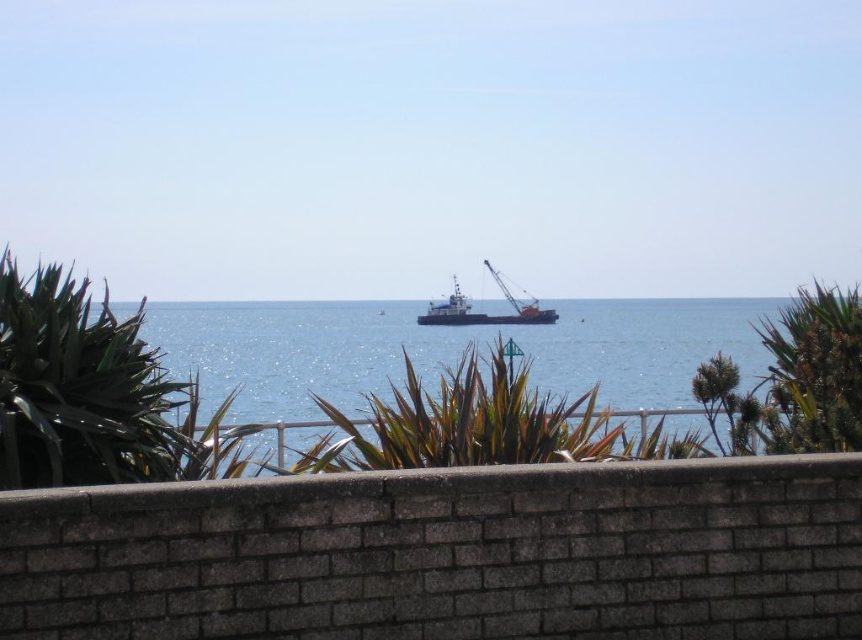
You are standing behind the low brick wall and want to take a photo of the blue water at center and the orange matte cargo ship at center. Which object will appear wider in the photo?

The blue water at center will appear wider in the photo because its width is larger than that of the orange matte cargo ship at center.

Looking at this image, you are standing behind the low brick wall in the scene and want to know if the blue water at center is taller than the orange matte cargo ship at center. Based on the scene, what can you conclude?

The blue water at center has a lesser height compared to the orange matte cargo ship at center, so the cargo ship is taller than the water in this view.